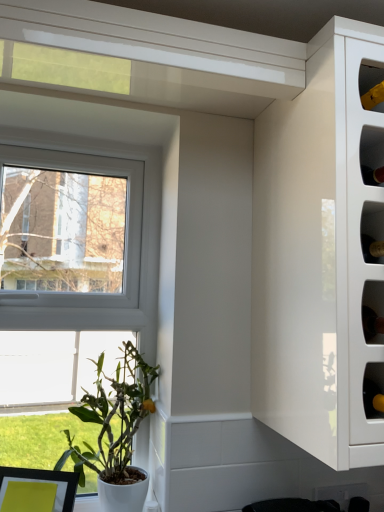
Where is `green matte plant at lower left`? The width and height of the screenshot is (384, 512). green matte plant at lower left is located at coordinates (112, 431).

Describe the element at coordinates (112, 431) in the screenshot. I see `green matte plant at lower left` at that location.

Measure the distance between point [129,397] and camera.

Point [129,397] and camera are 1.16 meters apart.

What is the approximate height of green matte plant at lower left?

It is 17.65 inches.

The height and width of the screenshot is (512, 384). Describe the element at coordinates (321, 255) in the screenshot. I see `white glossy cabinet at upper right` at that location.

Locate an element on the screen. white glossy cabinet at upper right is located at coordinates (321, 255).

Measure the distance between white glossy cabinet at upper right and camera.

They are 27.99 inches apart.

Identify the location of green matte plant at lower left. 112,431.

Is white glossy cabinet at upper right at the left side of green matte plant at lower left?

In fact, white glossy cabinet at upper right is to the right of green matte plant at lower left.

Is white glossy cabinet at upper right in front of or behind green matte plant at lower left in the image?

white glossy cabinet at upper right is in front of green matte plant at lower left.

Is point (260, 247) behind point (92, 421)?

No, it is not.

From the image's perspective, which object appears higher, white glossy cabinet at upper right or green matte plant at lower left?

white glossy cabinet at upper right is shown above in the image.

From a real-world perspective, is white glossy cabinet at upper right on green matte plant at lower left?

Yes, from a real-world perspective, white glossy cabinet at upper right is over green matte plant at lower left

Which object is thinner, white glossy cabinet at upper right or green matte plant at lower left?

With smaller width is green matte plant at lower left.

Considering the relative sizes of white glossy cabinet at upper right and green matte plant at lower left in the image provided, is white glossy cabinet at upper right shorter than green matte plant at lower left?

In fact, white glossy cabinet at upper right may be taller than green matte plant at lower left.

Considering the sizes of objects white glossy cabinet at upper right and green matte plant at lower left in the image provided, who is smaller, white glossy cabinet at upper right or green matte plant at lower left?

green matte plant at lower left is smaller.

Is white glossy cabinet at upper right surrounding green matte plant at lower left?

No, green matte plant at lower left is not a part of white glossy cabinet at upper right.

Is the surface of white glossy cabinet at upper right in direct contact with green matte plant at lower left?

No, white glossy cabinet at upper right is not in contact with green matte plant at lower left.

Could you tell me if white glossy cabinet at upper right is facing green matte plant at lower left?

No, white glossy cabinet at upper right is not oriented towards green matte plant at lower left.

Can you tell me how much white glossy cabinet at upper right and green matte plant at lower left differ in facing direction?

The angular difference between white glossy cabinet at upper right and green matte plant at lower left is 1.01 degrees.

Measure the distance between white glossy cabinet at upper right and green matte plant at lower left.

The distance of white glossy cabinet at upper right from green matte plant at lower left is 21.08 inches.

Find the location of a particular element. This screenshot has height=512, width=384. houseplant below the white glossy cabinet at upper right (from a real-world perspective) is located at coordinates (112, 431).

Visually, is green matte plant at lower left positioned to the left or to the right of white glossy cabinet at upper right?

In the image, green matte plant at lower left appears on the left side of white glossy cabinet at upper right.

Who is more distant, green matte plant at lower left or white glossy cabinet at upper right?

green matte plant at lower left is more distant.

Which is behind, point (125, 398) or point (311, 238)?

Positioned behind is point (125, 398).

From the image's perspective, which object appears higher, green matte plant at lower left or white glossy cabinet at upper right?

white glossy cabinet at upper right appears higher in the image.

From a real-world perspective, which object rests below the other?

green matte plant at lower left is physically lower.

Does green matte plant at lower left have a greater width compared to white glossy cabinet at upper right?

No.

Consider the image. Considering the relative sizes of green matte plant at lower left and white glossy cabinet at upper right in the image provided, is green matte plant at lower left shorter than white glossy cabinet at upper right?

Correct, green matte plant at lower left is not as tall as white glossy cabinet at upper right.

From the picture: Considering the sizes of objects green matte plant at lower left and white glossy cabinet at upper right in the image provided, who is smaller, green matte plant at lower left or white glossy cabinet at upper right?

green matte plant at lower left is smaller.

Is green matte plant at lower left spatially inside white glossy cabinet at upper right, or outside of it?

green matte plant at lower left cannot be found inside white glossy cabinet at upper right.

Is there a large distance between green matte plant at lower left and white glossy cabinet at upper right?

No, green matte plant at lower left is not far from white glossy cabinet at upper right.

Is green matte plant at lower left positioned with its back to white glossy cabinet at upper right?

green matte plant at lower left does not have its back to white glossy cabinet at upper right.

How different are the orientations of green matte plant at lower left and white glossy cabinet at upper right in degrees?

They differ by 1.01 degrees in their facing directions.

This screenshot has height=512, width=384. Find the location of `cabinetry in front of the green matte plant at lower left`. cabinetry in front of the green matte plant at lower left is located at coordinates (321, 255).

At what (x,y) coordinates should I click in order to perform the action: click on cabinetry that is in front of the green matte plant at lower left. Please return your answer as a coordinate pair (x, y). Looking at the image, I should click on (321, 255).

The width and height of the screenshot is (384, 512). Identify the location of houseplant located on the left of white glossy cabinet at upper right. (112, 431).